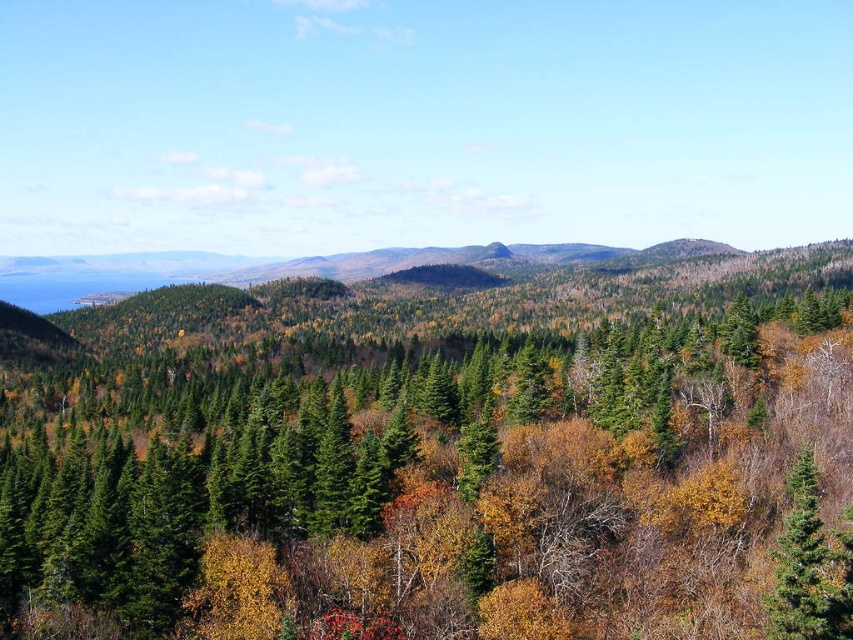
Based on the photo, can you confirm if green matte trees at center is smaller than green glossy evergreen tree at center-right?

No, green matte trees at center is not smaller than green glossy evergreen tree at center-right.

Is the position of green matte trees at center less distant than that of green glossy evergreen tree at center-right?

No, it is behind green glossy evergreen tree at center-right.

Which is in front, point (22, 480) or point (778, 593)?

Point (778, 593) is in front.

The image size is (853, 640). Identify the location of green matte trees at center. (448, 486).